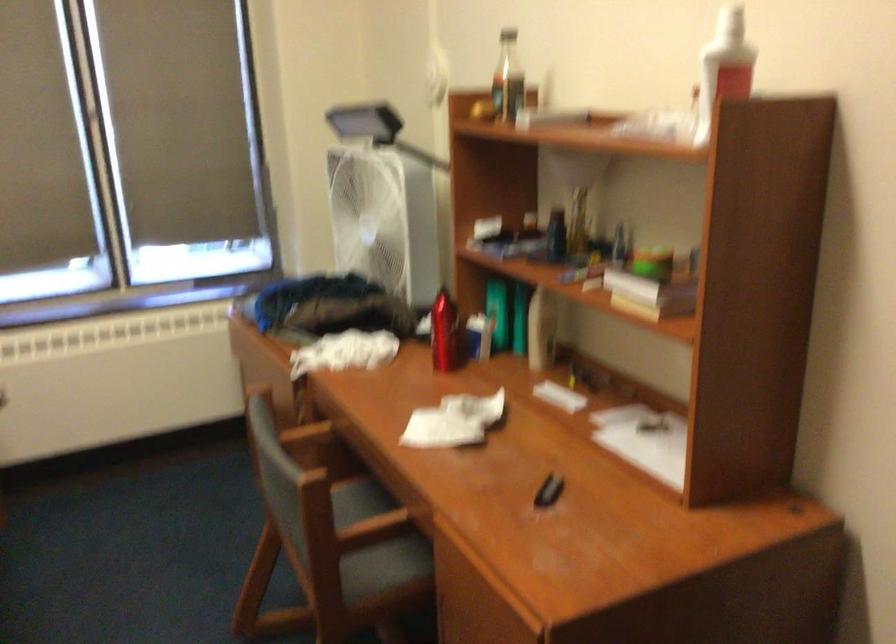
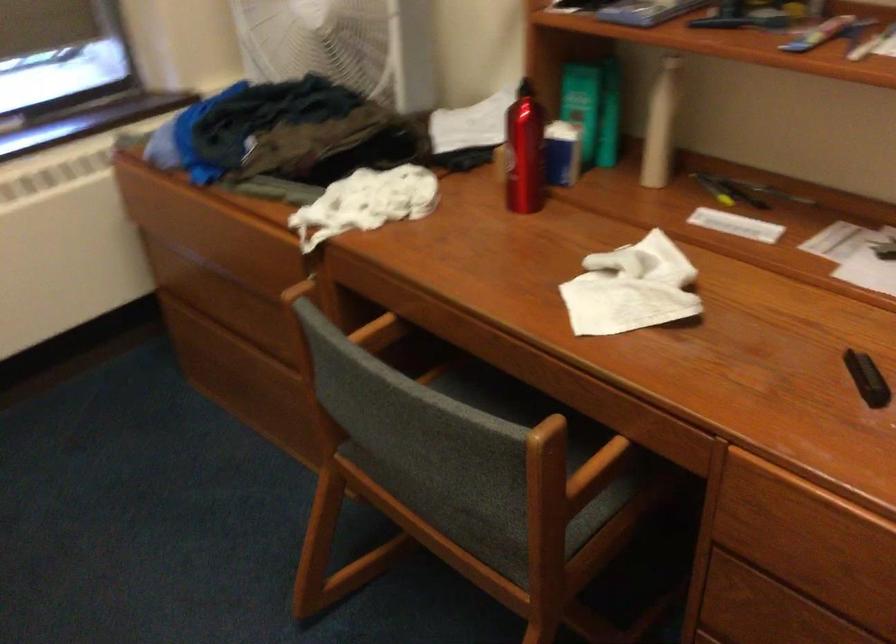
The point at (495,307) is marked in the first image. Where is the corresponding point in the second image?

(582, 104)